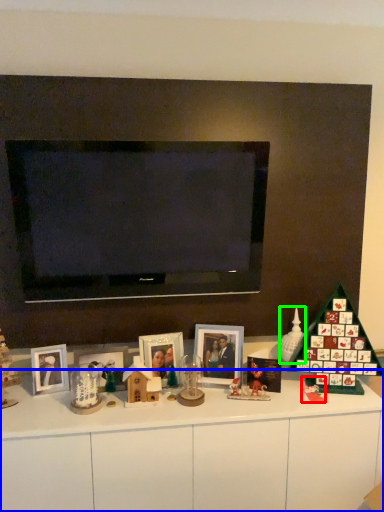
Question: Which object is positioned farthest from toy (highlighted by a red box)? Select from dresser (highlighted by a blue box) and toy (highlighted by a green box).

Choices:
 (A) dresser
 (B) toy

Answer: (A)